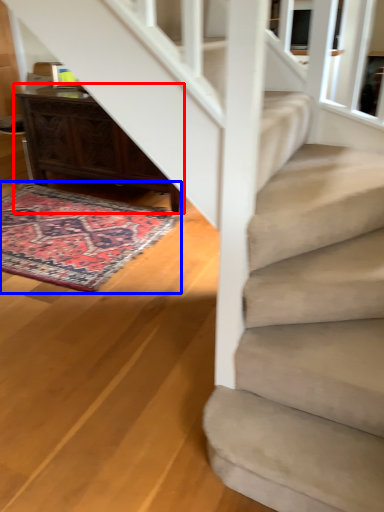
Question: Which object appears closest to the camera in this image, desk (highlighted by a red box) or mat (highlighted by a blue box)?

Choices:
 (A) desk
 (B) mat

Answer: (B)